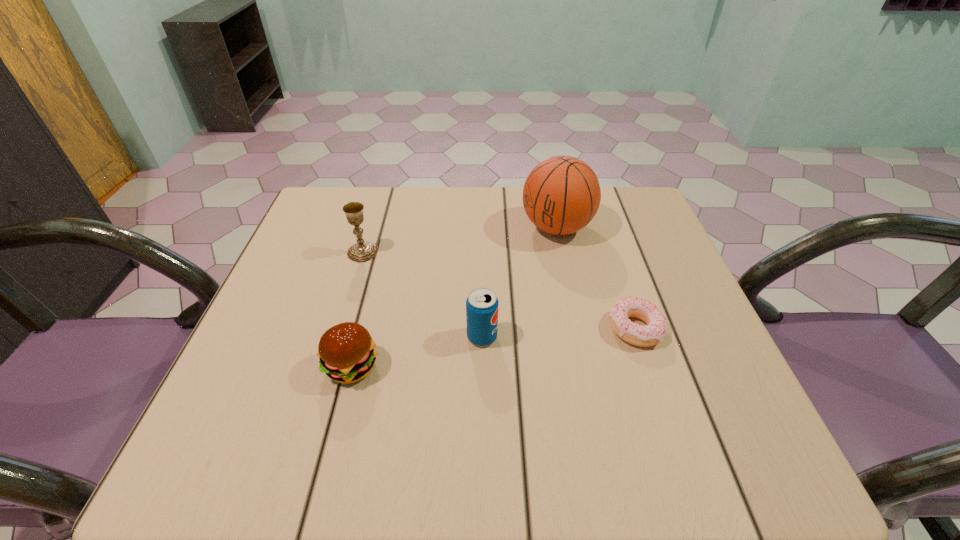
Image resolution: width=960 pixels, height=540 pixels. I want to click on object that is at the far edge, so click(x=561, y=195).

This screenshot has height=540, width=960. What are the coordinates of `object present at the left edge` in the screenshot? It's located at (362, 251).

Locate an element on the screen. This screenshot has width=960, height=540. object at the right edge is located at coordinates (639, 335).

Where is `free space at the far edge of the desktop`? free space at the far edge of the desktop is located at coordinates (375, 196).

Locate an element on the screen. The height and width of the screenshot is (540, 960). vacant space at the near edge of the desktop is located at coordinates (424, 444).

Identify the location of free region at the right edge. The image size is (960, 540). (636, 276).

In order to click on free space at the far left corner of the desktop in this screenshot , I will do `click(329, 224)`.

Locate an element on the screen. The height and width of the screenshot is (540, 960). free spot at the far right corner of the desktop is located at coordinates (621, 207).

At what (x,y) coordinates should I click in order to perform the action: click on free space between the basketball and the chalice. Please return your answer as a coordinate pair (x, y). This screenshot has height=540, width=960. Looking at the image, I should click on (460, 240).

Where is `vacant area between the shortest object and the soda can`? Image resolution: width=960 pixels, height=540 pixels. vacant area between the shortest object and the soda can is located at coordinates (559, 333).